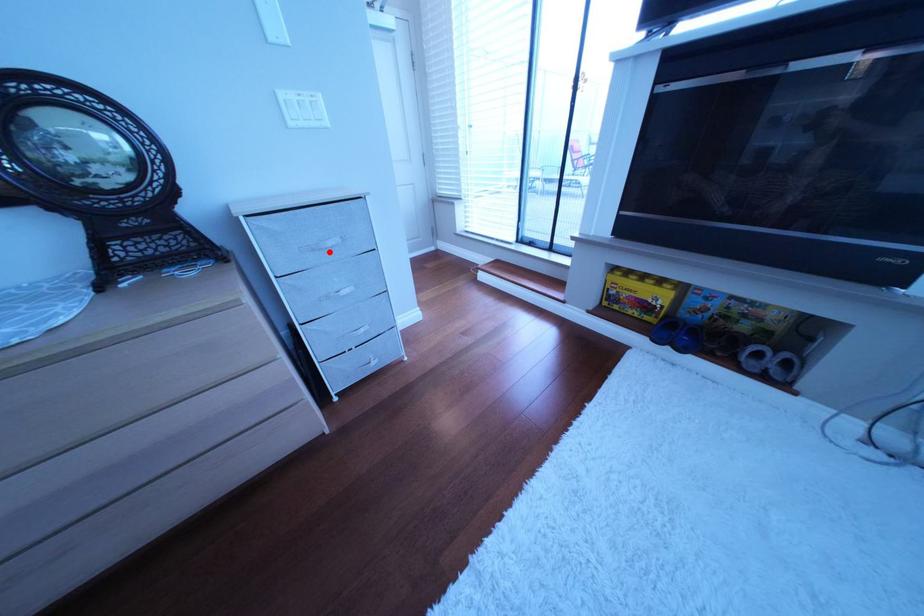
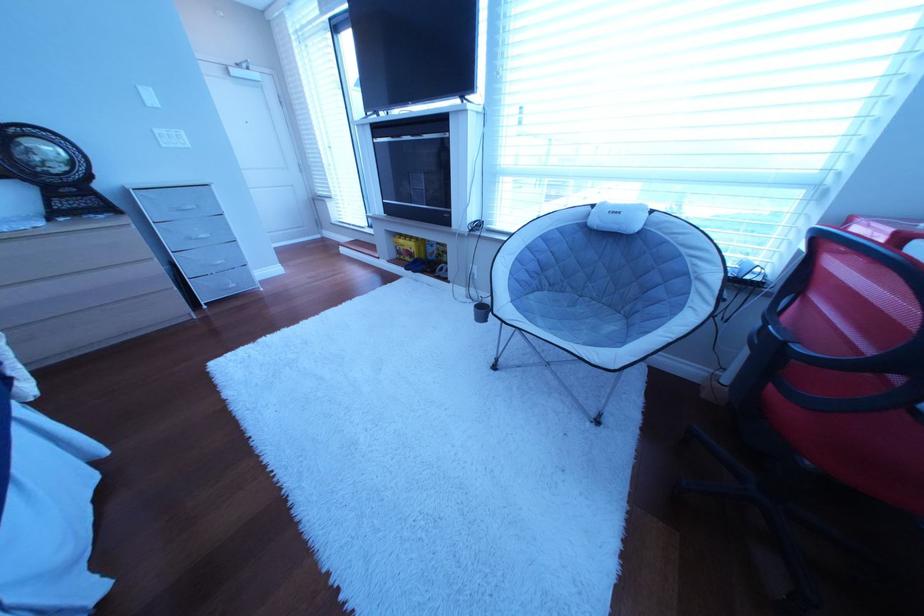
In the second image, find the point that corresponds to the highlighted location in the first image.

(193, 213)